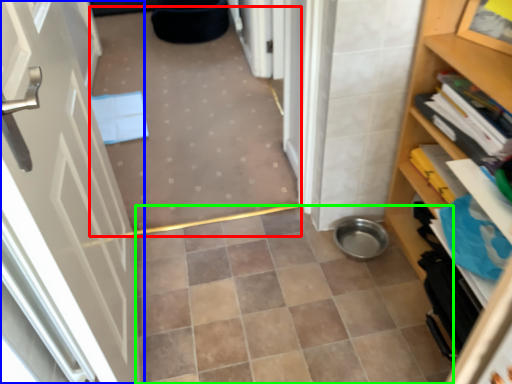
Question: Which object is the closest to the plain (highlighted by a red box)? Choose among these: door (highlighted by a blue box) or ceramic tile (highlighted by a green box).

Choices:
 (A) door
 (B) ceramic tile

Answer: (B)